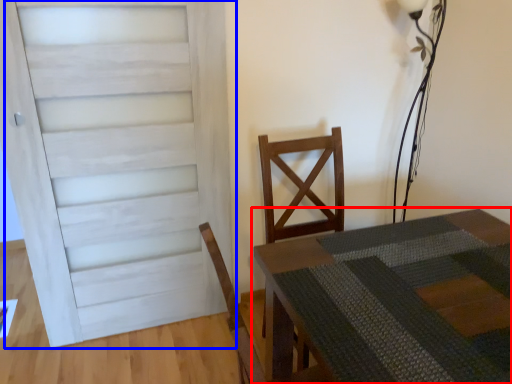
Question: Which of the following is the farthest to the observer, table (highlighted by a red box) or door (highlighted by a blue box)?

Choices:
 (A) table
 (B) door

Answer: (B)